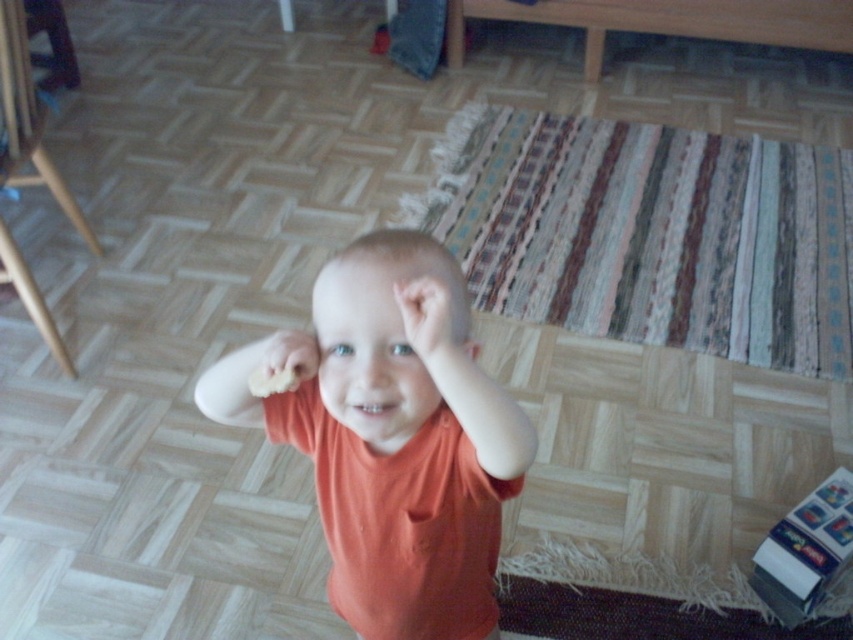
In the scene shown: You are a photographer trying to capture the perfect shot of the scene. You need to determine which of the two points, point (x=410, y=412) or point (x=254, y=371), is closer to the camera lens. Based on the spatial information provided, which point is closer?

Point (x=254, y=371) is closer to the camera lens because the description states that point (x=410, y=412) is further away than point (x=254, y=371).

You are a delivery robot that needs to place a package at point (335, 305). The package requires a minimum of 80 centimeters of space to avoid tipping over. Can you safely place the package at that point?

The distance of point (335, 305) from camera is 78.25 centimeters, which is less than the required 80 centimeters. Therefore, placing the package there may cause it to tip over, so it is not safe.

You are a photographer setting up a shot of the child. You have two points marked in the scene for focus. Which point should you choose to ensure the child is in focus? The points are point 1 at coordinates point (410, 349) and point 2 at coordinates point (477, 353). Please explain your choice based on their positions relative to the viewer.

You should choose point 1 at coordinates point (410, 349) because it is closer to the viewer than point 2 at coordinates point (477, 353), ensuring the child is in focus.